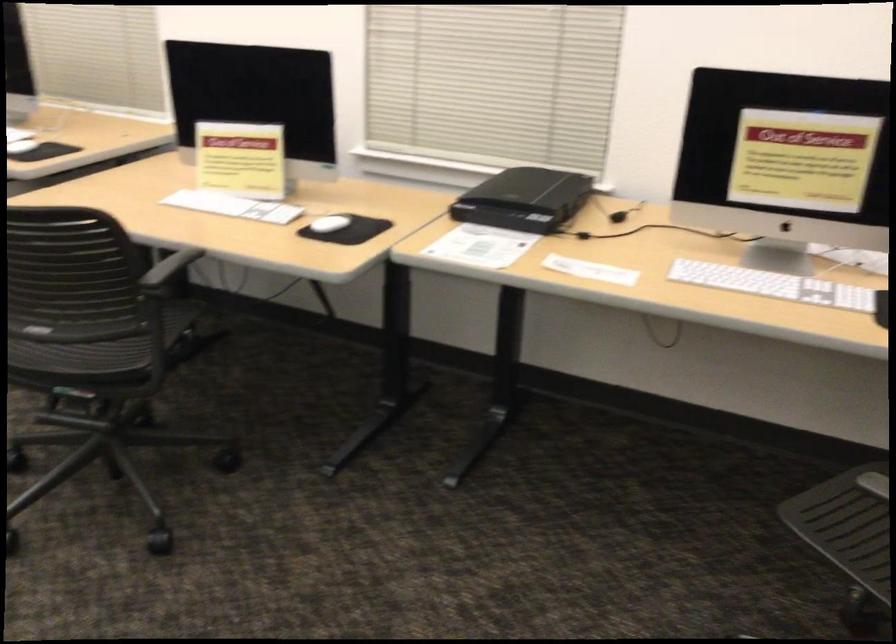
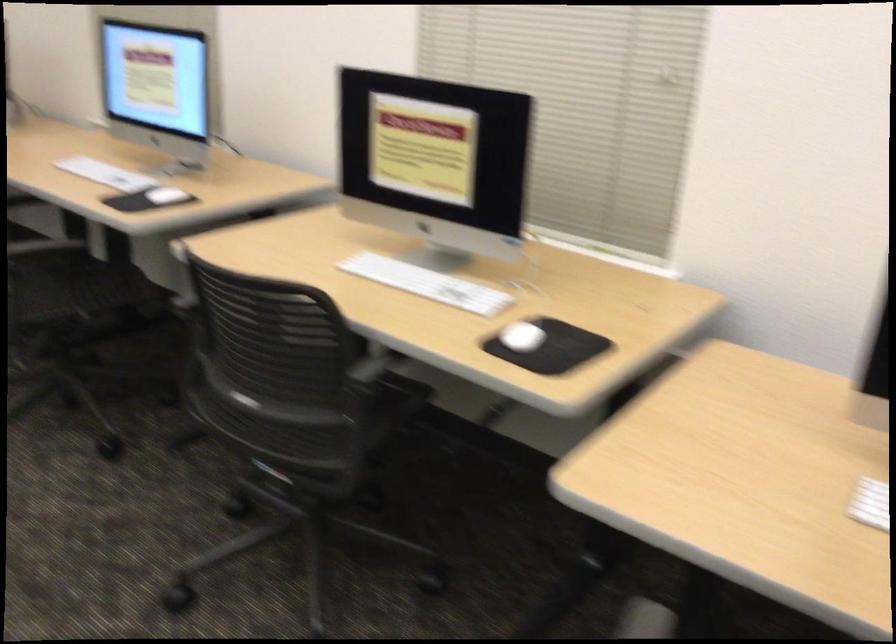
Which direction would the cameraman need to move to produce the second image?

The movement direction of the cameraman is left, forward.